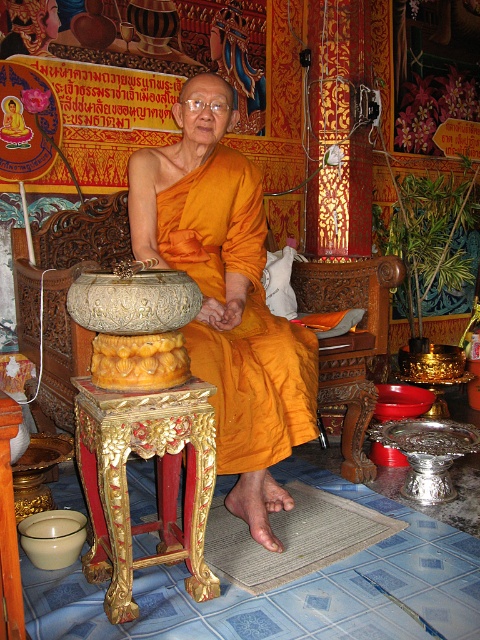
You are a visitor in this temple and want to sit next to the carved wood chair at center. However, there is a matte orange robe at center nearby. Can you estimate whether the robe is wider than the chair?

The matte orange robe at center is wider than the carved wood chair at center according to the description provided.